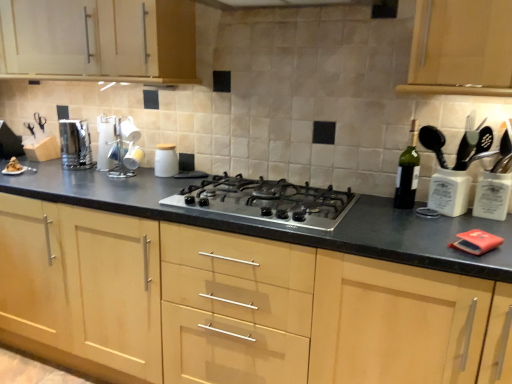
Question: Is polished stainless steel toaster at left, the 2th kitchen appliance when ordered from right to left, to the left or to the right of white ceramic jar at center, the first kitchen appliance from the right, in the image?

Choices:
 (A) right
 (B) left

Answer: (B)

Question: Does point (60, 144) appear closer or farther from the camera than point (164, 175)?

Choices:
 (A) closer
 (B) farther

Answer: (B)

Question: Which object is the closest to the white ceramic jar at center, the second kitchen appliance from the left?

Choices:
 (A) polished stainless steel toaster at left, the 2th kitchen appliance when ordered from right to left
 (B) satin silver gas stove at center
 (C) light wood cabinet at center, marked as the first cabinetry in a bottom-to-top arrangement
 (D) green glass bottle at right
 (E) matte wood cabinet at upper left, which ranks as the 2th cabinetry in bottom-to-top order

Answer: (A)

Question: Which object is the farthest from the green glass bottle at right?

Choices:
 (A) polished stainless steel toaster at left, the 2th kitchen appliance when ordered from right to left
 (B) satin silver gas stove at center
 (C) white ceramic jar at center, the first kitchen appliance from the right
 (D) white ceramic mugs at upper left
 (E) matte wood cabinet at upper left, which appears as the 1th cabinetry when viewed from the top

Answer: (A)